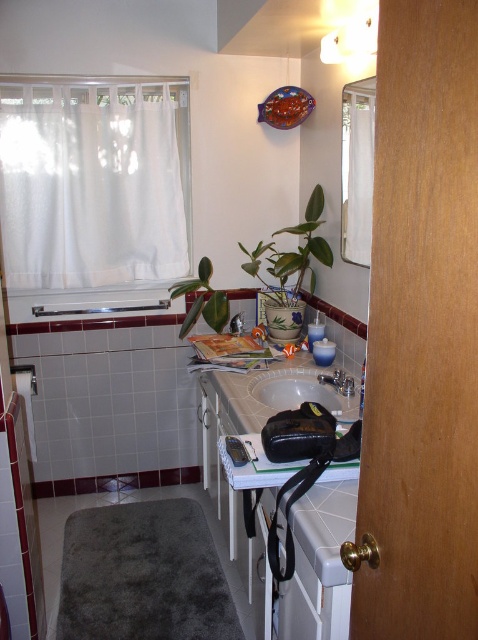
Question: Which point appears closest to the camera in this image?

Choices:
 (A) (351, 241)
 (B) (328, 390)
 (C) (321, 372)

Answer: (B)

Question: Does white sheer curtain at upper left appear under white glossy vanity at center?

Choices:
 (A) yes
 (B) no

Answer: (B)

Question: Can you confirm if green matte plant at upper center is positioned to the right of satin nickel faucet at sink right?

Choices:
 (A) no
 (B) yes

Answer: (A)

Question: Is transparent glass mirror at upper center above green matte plant at center?

Choices:
 (A) no
 (B) yes

Answer: (B)

Question: Estimate the real-world distances between objects in this image. Which object is farther from the transparent glass mirror at upper center?

Choices:
 (A) green matte plant at center
 (B) satin nickel faucet at sink right

Answer: (A)

Question: Considering the real-world distances, which object is closest to the white glossy vanity at center?

Choices:
 (A) transparent glass mirror at upper center
 (B) white glossy sink at center
 (C) white sheer curtain at upper left
 (D) green matte plant at center

Answer: (B)